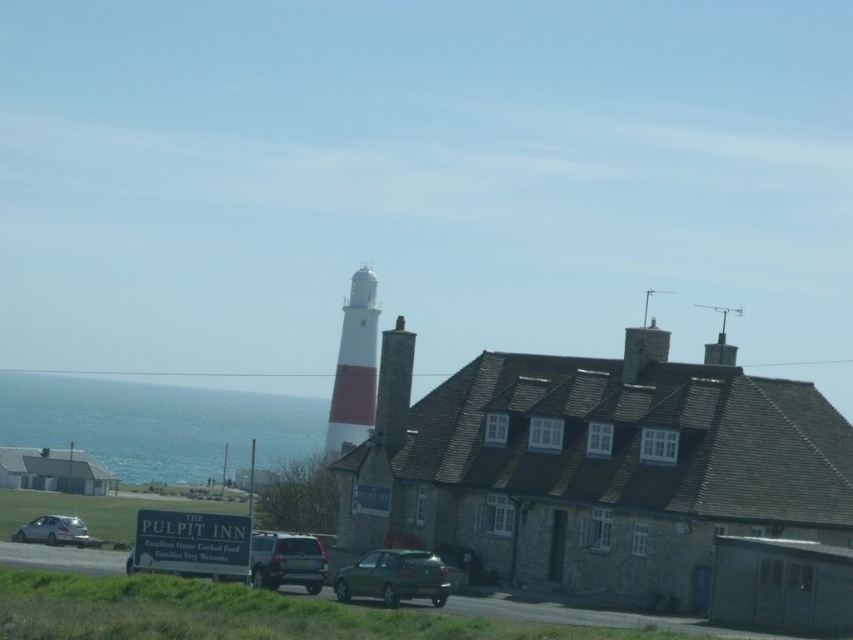
Question: Can you confirm if blue water at lower left is bigger than satin silver suv at center?

Choices:
 (A) yes
 (B) no

Answer: (A)

Question: Which object is closer to the camera taking this photo?

Choices:
 (A) silver metallic car at lower left
 (B) blue water at lower left
 (C) green matte hatchback at center
 (D) satin silver suv at center

Answer: (D)

Question: Estimate the real-world distances between objects in this image. Which object is farther from the white painted stone tower at center?

Choices:
 (A) blue water at lower left
 (B) silver metallic car at lower left

Answer: (A)

Question: Does white painted stone tower at center have a larger size compared to satin silver suv at center?

Choices:
 (A) yes
 (B) no

Answer: (A)

Question: Which of the following is the farthest from the observer?

Choices:
 (A) blue water at lower left
 (B) satin silver suv at center

Answer: (A)

Question: Does blue water at lower left come behind silver metallic car at lower left?

Choices:
 (A) no
 (B) yes

Answer: (B)